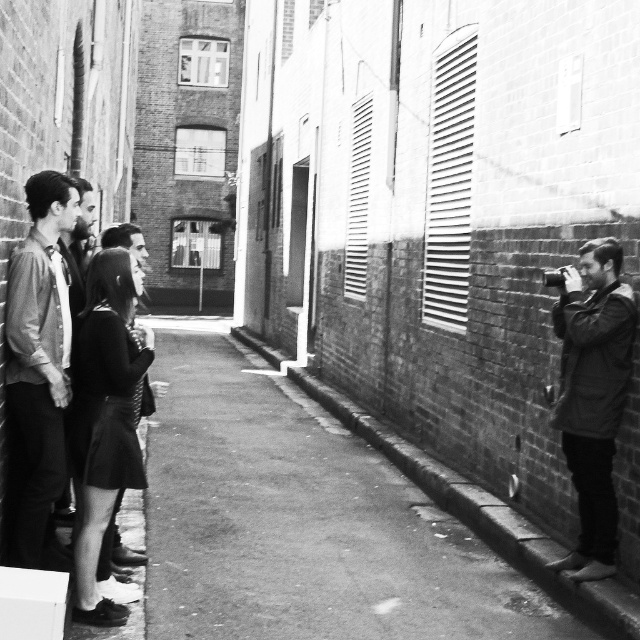
Does dark gray coat at right appear over smooth concrete curb at lower right?

Yes.

Which is behind, point (595, 342) or point (525, 556)?

Point (525, 556)

The height and width of the screenshot is (640, 640). Find the location of `dark gray coat at right`. dark gray coat at right is located at coordinates (593, 396).

Describe the element at coordinates (36, 365) in the screenshot. I see `denim shirt at left` at that location.

Can you confirm if denim shirt at left is wider than smooth concrete curb at lower right?

No.

Is point (29, 333) farther from viewer compared to point (397, 445)?

No.

Locate an element on the screen. The image size is (640, 640). denim shirt at left is located at coordinates (36, 365).

Can you confirm if denim shirt at left is wider than dark gray coat at right?

In fact, denim shirt at left might be narrower than dark gray coat at right.

Is point (49, 285) closer to viewer compared to point (618, 388)?

Yes, point (49, 285) is in front of point (618, 388).

Does point (65, 472) come behind point (576, 467)?

That is False.

I want to click on denim shirt at left, so click(36, 365).